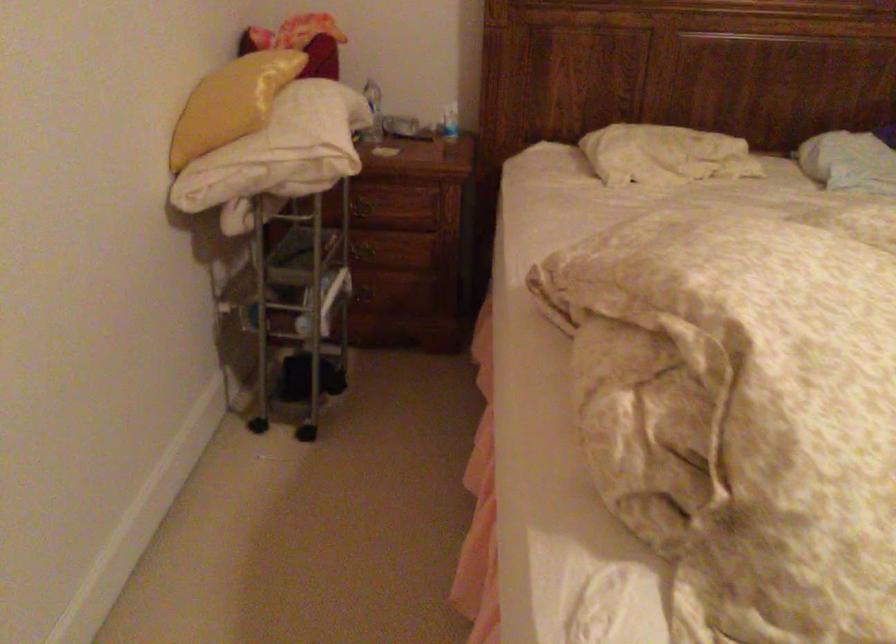
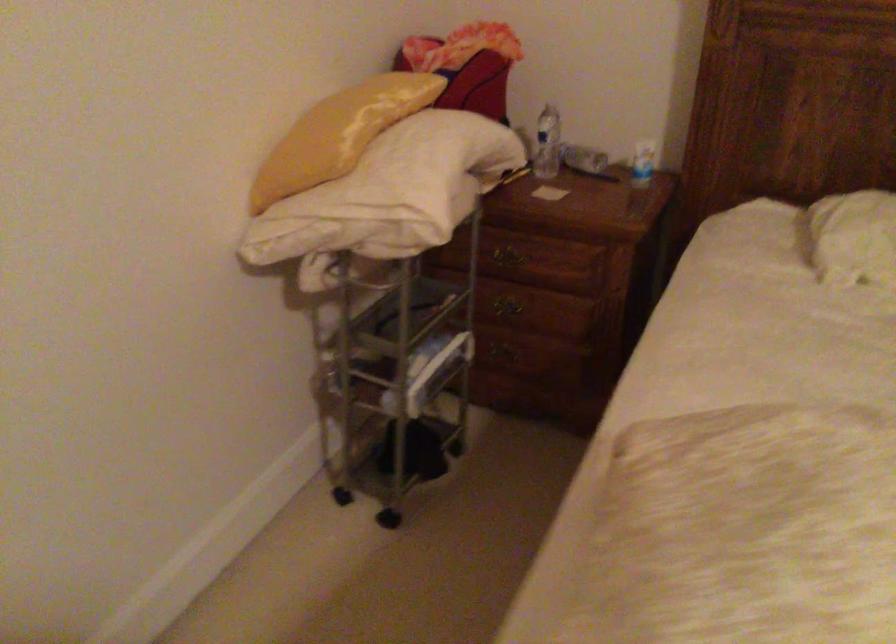
In a continuous first-person perspective shot, in which direction is the camera moving?

The movement direction of the cameraman is right, forward.